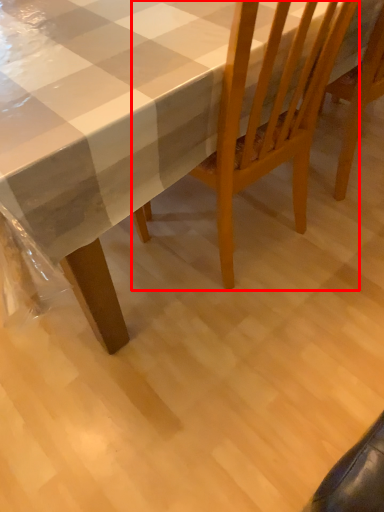
Question: From the image's perspective, where is chair (annotated by the red box) located in relation to table in the image?

Choices:
 (A) below
 (B) above

Answer: (A)